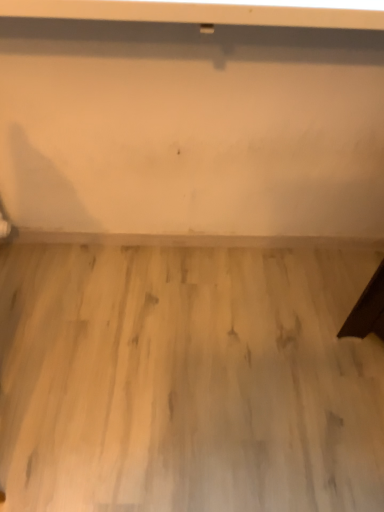
The width and height of the screenshot is (384, 512). What do you see at coordinates (187, 379) in the screenshot?
I see `light wood plywood at center` at bounding box center [187, 379].

Find the location of `light wood plywood at center`. light wood plywood at center is located at coordinates (187, 379).

At what (x,y) coordinates should I click in order to perform the action: click on light wood plywood at center. Please return your answer as a coordinate pair (x, y). Looking at the image, I should click on (187, 379).